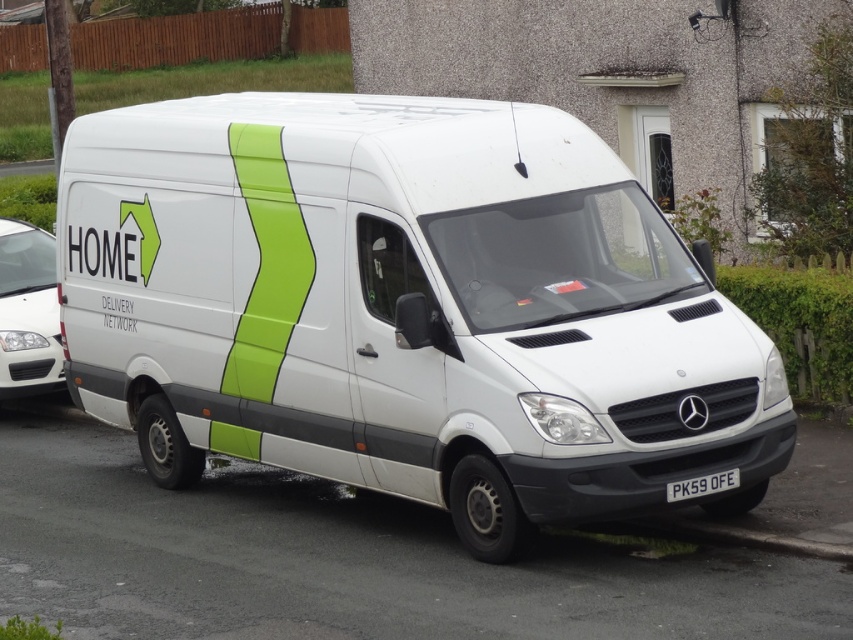
Is white glossy car at left smaller than white plastic license plate at lower center?

No, white glossy car at left is not smaller than white plastic license plate at lower center.

Is point (45, 236) less distant than point (689, 492)?

No, (45, 236) is further to viewer.

Between point (27, 376) and point (691, 496), which one is positioned behind?

Point (27, 376)

Find the location of a particular element. Image resolution: width=853 pixels, height=640 pixels. white glossy car at left is located at coordinates (28, 312).

Is white matte van at center bigger than white plastic license plate at lower center?

Yes.

Is point (264, 248) closer to camera compared to point (730, 474)?

No, (264, 248) is further to viewer.

At what (x,y) coordinates should I click in order to perform the action: click on white matte van at center. Please return your answer as a coordinate pair (x, y). Image resolution: width=853 pixels, height=640 pixels. Looking at the image, I should click on (405, 308).

Does white matte van at center come behind white glossy car at left?

No.

Is point (526, 442) closer to camera compared to point (20, 221)?

Yes, it is in front of point (20, 221).

Find the location of a particular element. white matte van at center is located at coordinates (405, 308).